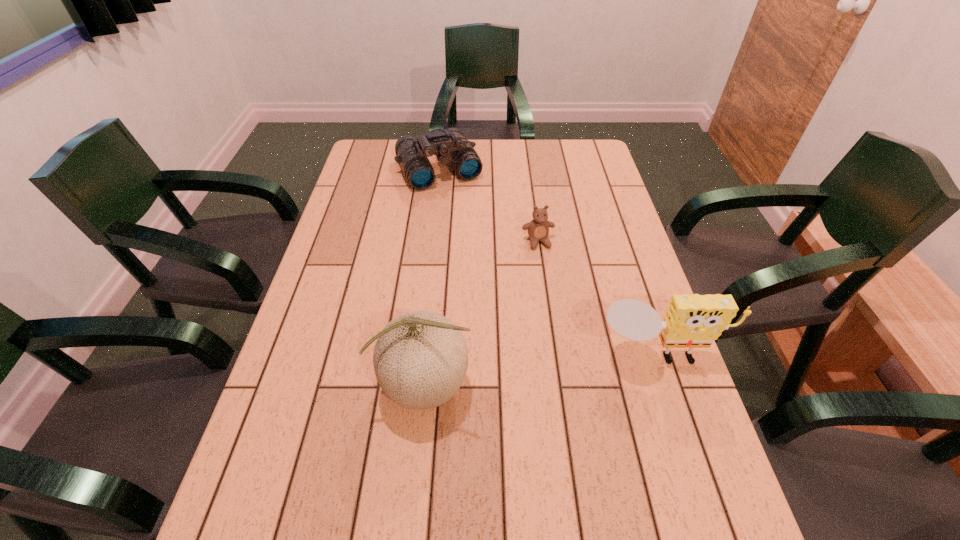
Where is `free space at the left edge of the desktop`? The image size is (960, 540). free space at the left edge of the desktop is located at coordinates (371, 218).

Where is `blank space at the right edge`? blank space at the right edge is located at coordinates (609, 202).

In the image, there is a desktop. Identify the location of vacant space at the far left corner. The height and width of the screenshot is (540, 960). (374, 146).

In the image, there is a desktop. Identify the location of free space at the near left corner. This screenshot has width=960, height=540. (240, 487).

Identify the location of vacant space at the far right corner of the desktop. (570, 155).

In the image, there is a desktop. Where is `vacant space at the near right corner`? vacant space at the near right corner is located at coordinates (681, 479).

Identify the location of vacant space that is in between the cantaloup and the sponge. (542, 370).

This screenshot has height=540, width=960. I want to click on unoccupied position between the farthest object and the second tallest object, so click(549, 262).

The image size is (960, 540). In order to click on empty space between the rightmost object and the farthest object in this screenshot , I will do `click(549, 262)`.

Locate an element on the screen. The height and width of the screenshot is (540, 960). vacant area that lies between the sponge and the shortest object is located at coordinates (598, 298).